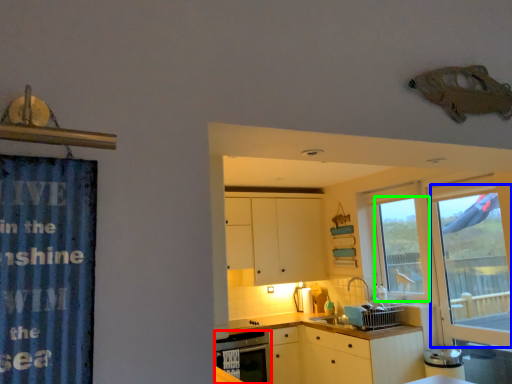
Question: Considering the real-world distances, which object is closest to dish washer (highlighted by a red box)? glass door (highlighted by a blue box) or window (highlighted by a green box).

Choices:
 (A) glass door
 (B) window

Answer: (B)